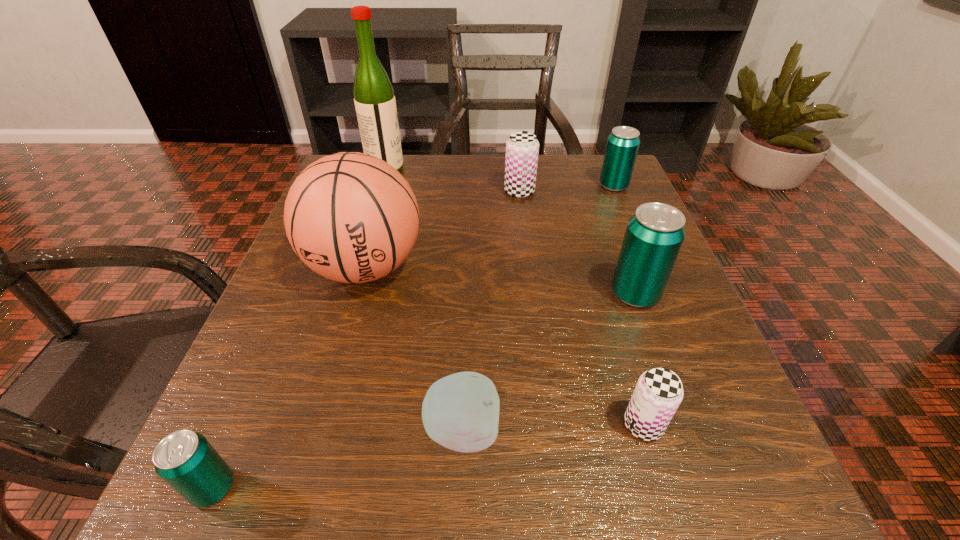
Identify the location of free space between the leftmost teal beer can and the second farthest teal beer can. (424, 391).

This screenshot has width=960, height=540. In order to click on unoccupied position between the orange basketball and the leftmost teal beer can in this screenshot , I will do (289, 377).

Identify the location of vacant area between the sixth shortest object and the orange basketball. The width and height of the screenshot is (960, 540). (500, 281).

Identify the location of free space between the farthest teal beer can and the second nearest beer can. pyautogui.click(x=629, y=305).

The width and height of the screenshot is (960, 540). What are the coordinates of `vacant space that is in between the nearest beer can and the farther purple beer can` in the screenshot? It's located at (367, 340).

Where is `empty space that is in between the second nearest beer can and the leftmost teal beer can`? This screenshot has width=960, height=540. empty space that is in between the second nearest beer can and the leftmost teal beer can is located at coordinates (428, 456).

Find the location of a particular element. This screenshot has height=540, width=960. vacant point located between the apple and the orange basketball is located at coordinates (414, 349).

The height and width of the screenshot is (540, 960). I want to click on free space that is in between the basketball and the left purple beer can, so click(x=443, y=229).

Select which object is the second closest to the second smallest teal beer can. Please provide its 2D coordinates. Your answer should be formatted as a tuple, i.e. [(x, y)], where the tuple contains the x and y coordinates of a point satisfying the conditions above.

[(654, 235)]

Locate an element on the screen. This screenshot has width=960, height=540. object that is the third nearest to the fourth object from left to right is located at coordinates (185, 460).